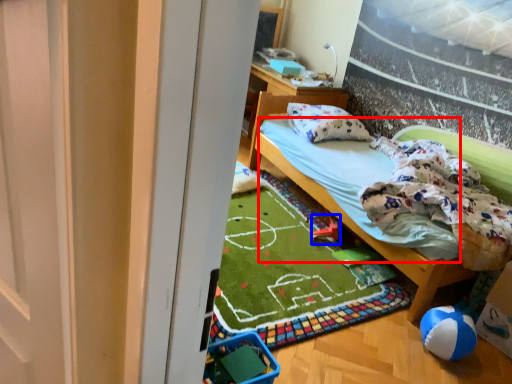
Question: Which object is further to the camera taking this photo, mattress (highlighted by a red box) or toy (highlighted by a blue box)?

Choices:
 (A) mattress
 (B) toy

Answer: (B)